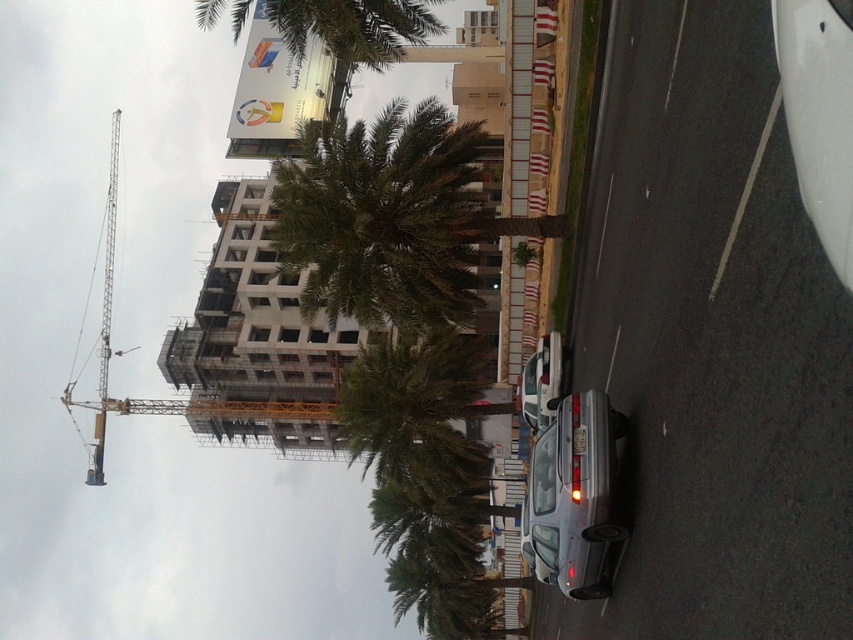
Which is behind, point (436, 170) or point (556, 408)?

The point (556, 408) is more distant.

Does green leafy palm tree at center come in front of silver metallic car at center?

No, it is behind silver metallic car at center.

Measure the distance between green leafy palm tree at center and camera.

The distance of green leafy palm tree at center from camera is 58.54 meters.

Identify the location of green leafy palm tree at center. (402, 337).

Can you confirm if silver metallic car at lower left is positioned to the right of green leafy palm tree at center?

Yes, silver metallic car at lower left is to the right of green leafy palm tree at center.

Is silver metallic car at lower left below green leafy palm tree at center?

Indeed, silver metallic car at lower left is positioned under green leafy palm tree at center.

Is point (610, 116) behind point (483, 628)?

No, (610, 116) is in front of (483, 628).

At what (x,y) coordinates should I click in order to perform the action: click on silver metallic car at lower left. Please return your answer as a coordinate pair (x, y). Image resolution: width=853 pixels, height=640 pixels. Looking at the image, I should click on (711, 342).

Is point (801, 516) closer to camera compared to point (328, 8)?

Yes.

Which is behind, point (668, 604) or point (292, 29)?

Point (292, 29)

Between point (791, 218) and point (212, 8), which one is positioned in front?

Positioned in front is point (791, 218).

What are the coordinates of `silver metallic car at lower left` in the screenshot? It's located at (711, 342).